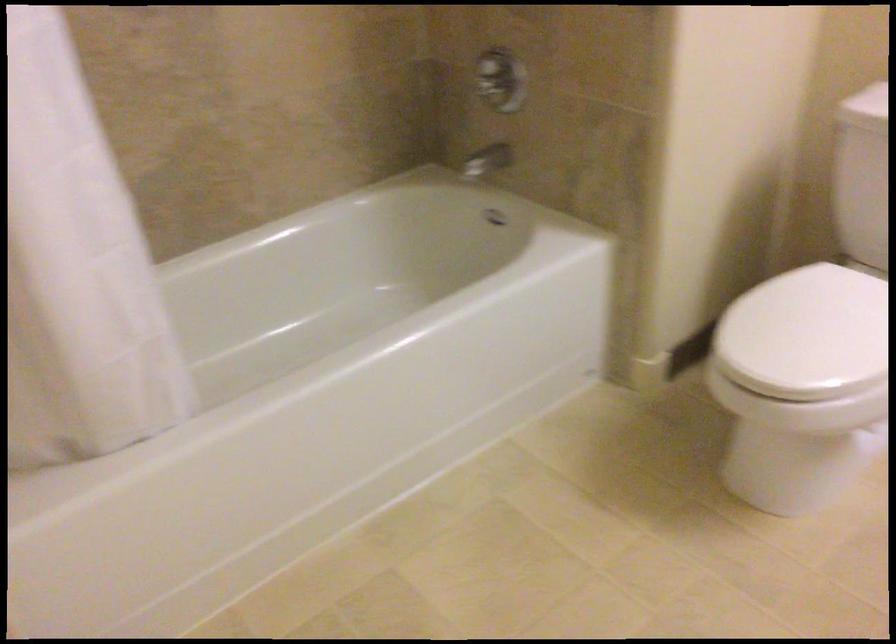
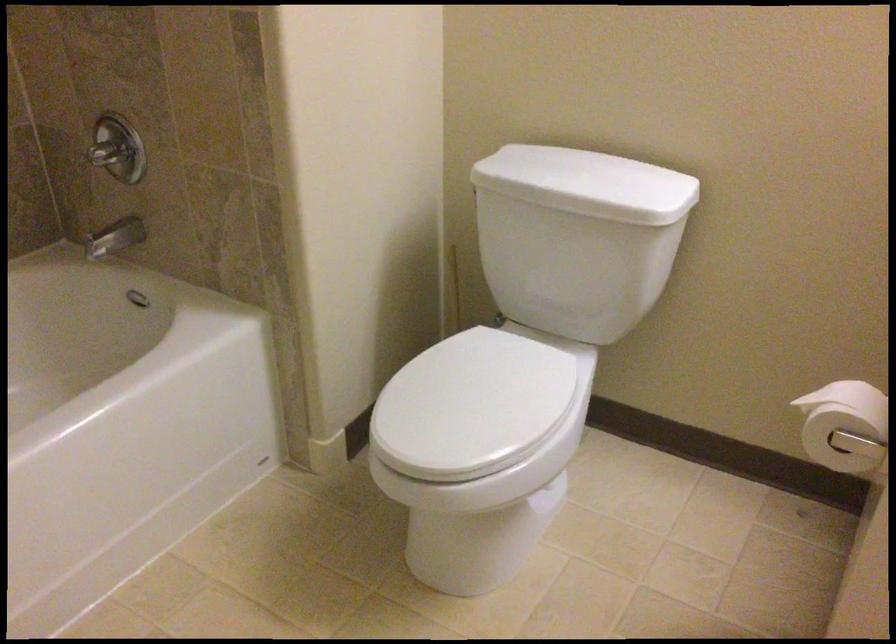
Which direction would the cameraman need to move to produce the second image?

The cameraman moved toward right, forward.